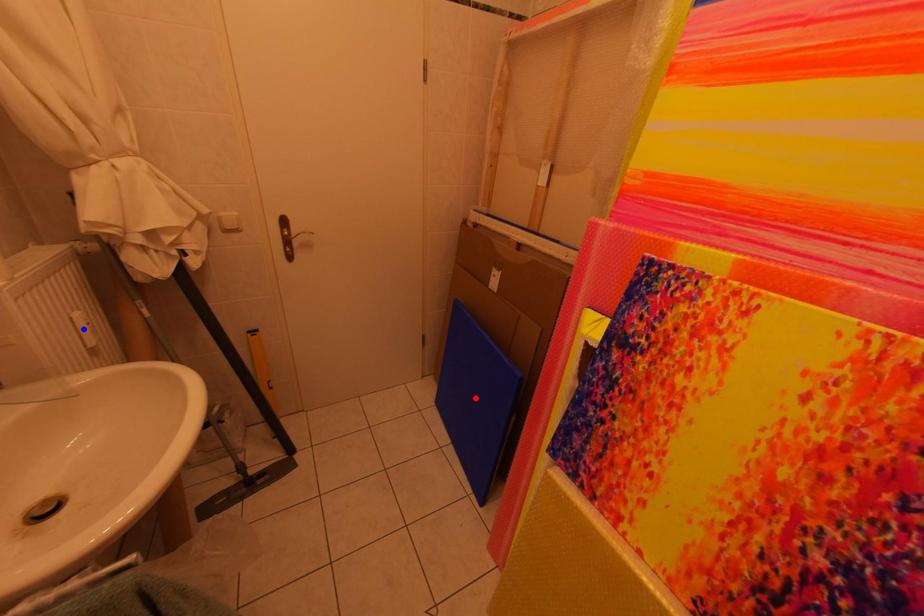
Question: Which of the two points in the image is closer to the camera?

Choices:
 (A) Blue point is closer.
 (B) Red point is closer.

Answer: (A)